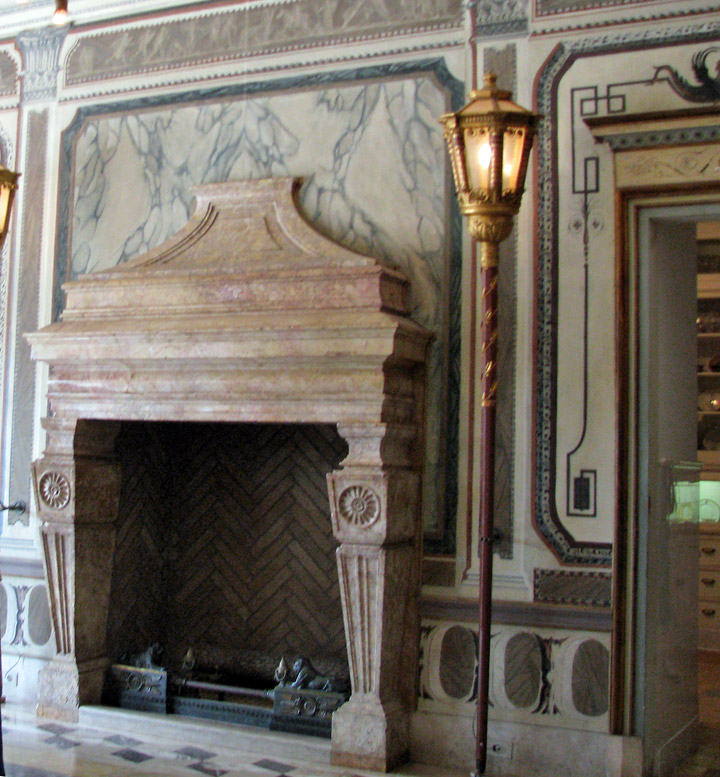
This screenshot has width=720, height=777. Find the location of `corbel`. corbel is located at coordinates (199, 399).